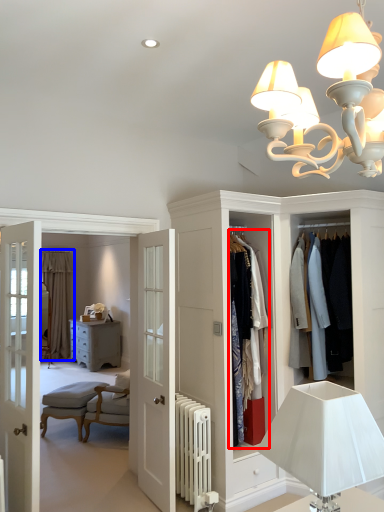
Question: Among these objects, which one is nearest to the camera, clothing (highlighted by a red box) or curtain (highlighted by a blue box)?

Choices:
 (A) clothing
 (B) curtain

Answer: (A)